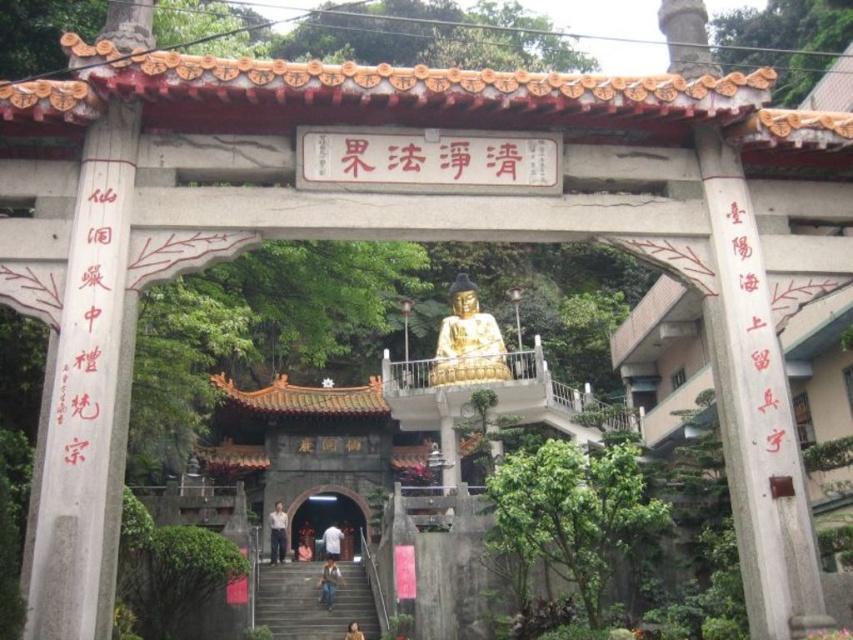
Question: Which point appears closest to the camera in this image?

Choices:
 (A) (328, 557)
 (B) (363, 637)
 (C) (271, 563)
 (D) (308, 516)

Answer: (B)

Question: Can you confirm if gray concrete stairs at lower center is positioned to the right of smooth stone archway at center?

Choices:
 (A) no
 (B) yes

Answer: (B)

Question: Based on their relative distances, which object is farther from the blue jeans at lower center?

Choices:
 (A) gray concrete stairs at lower center
 (B) light brown fabric shirt at center
 (C) golden metallic statue at center

Answer: (B)

Question: Is black calligraphy at left positioned at the back of gold polished statue at center?

Choices:
 (A) yes
 (B) no

Answer: (B)

Question: Where is blue jeans at lower center located in relation to golden metallic statue at center in the image?

Choices:
 (A) left
 (B) right

Answer: (A)

Question: Which of the following is the farthest from the observer?

Choices:
 (A) (352, 621)
 (B) (335, 554)

Answer: (B)